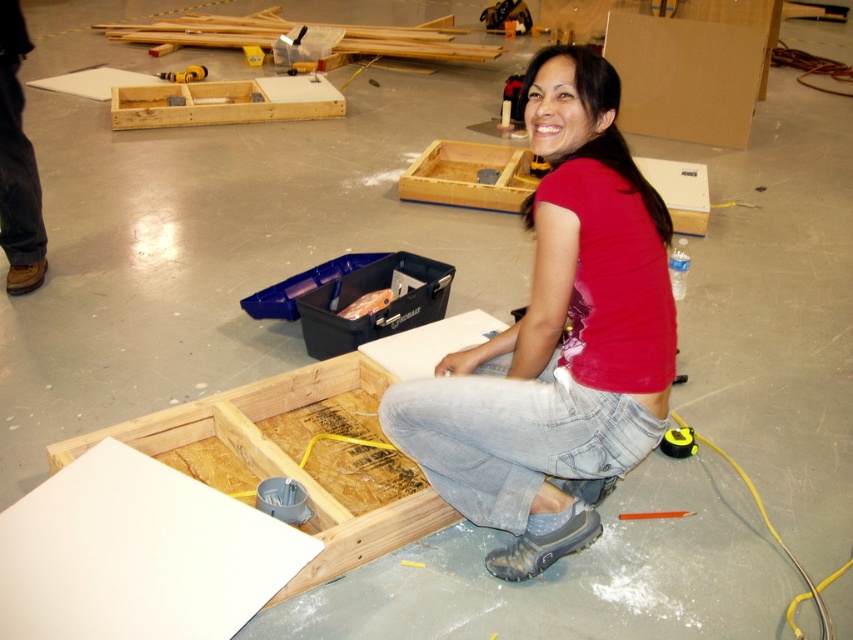
You are a delivery person who needs to place a 5 meter long ladder in the workspace. You see the red matte shirt at center and the wooden planks at upper center. Can you fit the ladder between them without bending it?

The red matte shirt at center and the wooden planks at upper center are 4.97 meters apart from each other. Since the ladder is 5 meters long, it cannot fit between them without bending because the distance is slightly shorter than the ladder.

You are organizing tools in the workspace. You need to place a new tool in the same location as the black plastic toolbox at center. Where should you place it relative to the yellow plastic tape measure at center?

The black plastic toolbox at center is on the right side of the yellow plastic tape measure at center, so you should place the new tool to the right of the yellow plastic tape measure at center.